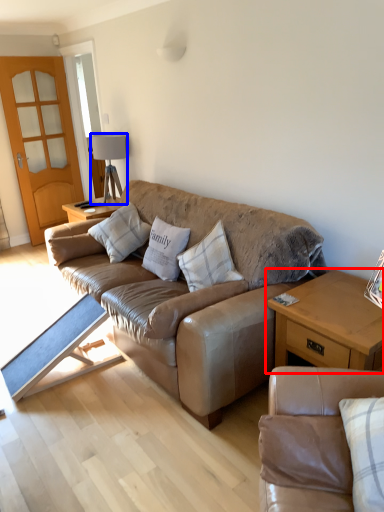
Question: Which object appears farthest to the camera in this image, table (highlighted by a red box) or lamp (highlighted by a blue box)?

Choices:
 (A) table
 (B) lamp

Answer: (B)